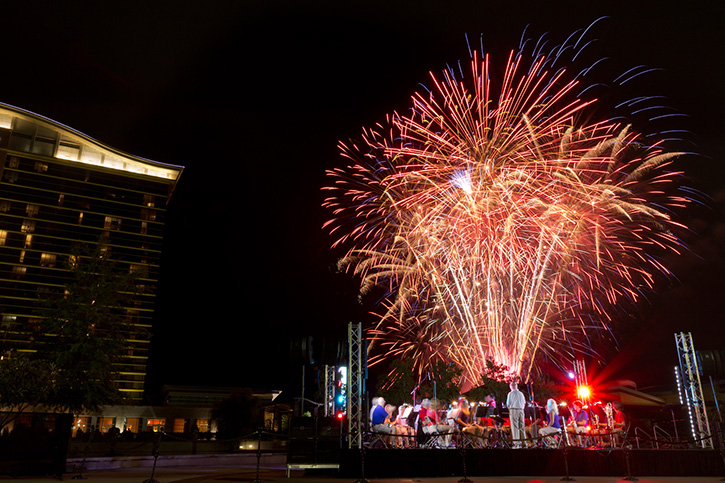
Image resolution: width=725 pixels, height=483 pixels. What are the coordinates of `green light` in the screenshot? It's located at (339, 398).